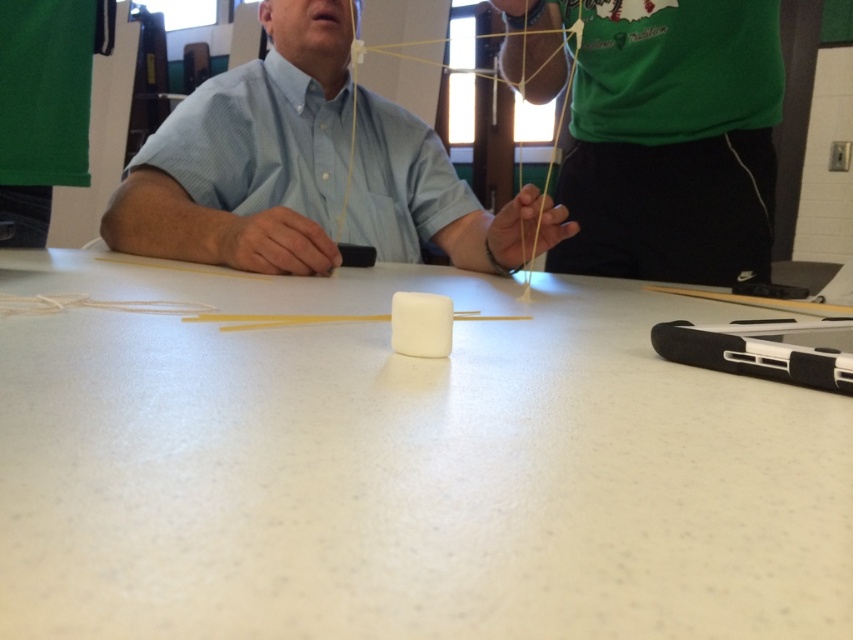
Question: Which point is closer to the camera?

Choices:
 (A) matte blue shirt at center
 (B) green matte shirt at upper center
 (C) white matte table at center

Answer: (C)

Question: Does matte blue shirt at center come behind green matte shirt at upper center?

Choices:
 (A) yes
 (B) no

Answer: (A)

Question: Which point is farther from the camera taking this photo?

Choices:
 (A) (309, 230)
 (B) (705, 177)

Answer: (B)

Question: Does matte blue shirt at center lie behind green matte shirt at upper center?

Choices:
 (A) no
 (B) yes

Answer: (B)

Question: Which is farther from the green matte shirt at upper center?

Choices:
 (A) matte blue shirt at center
 (B) white matte table at center

Answer: (B)

Question: Observing the image, what is the correct spatial positioning of white matte table at center in reference to green matte shirt at upper center?

Choices:
 (A) right
 (B) left

Answer: (B)